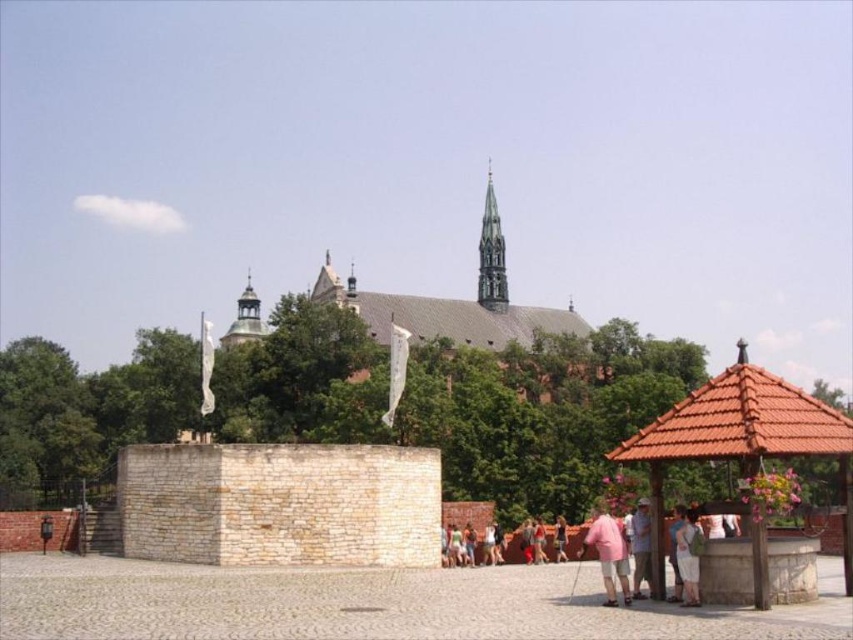
Question: Which object is farther from the camera taking this photo?

Choices:
 (A) pink fabric dress at lower center
 (B) pink cotton shirt at lower center

Answer: (A)

Question: Does pink cotton shirt at lower center have a smaller size compared to red dress at lower right?

Choices:
 (A) yes
 (B) no

Answer: (B)

Question: Does light brown fabric dress at lower right appear under gold textured dome at center?

Choices:
 (A) yes
 (B) no

Answer: (A)

Question: Which point is closer to the camera taking this photo?

Choices:
 (A) (248, 317)
 (B) (631, 518)
 (C) (691, 577)

Answer: (C)

Question: Can you confirm if pink cotton shirt at lower center is positioned above gold textured dome at center?

Choices:
 (A) yes
 (B) no

Answer: (B)

Question: Which of the following is the farthest from the observer?

Choices:
 (A) (643, 522)
 (B) (605, 540)
 (C) (688, 552)
 (D) (737, 356)

Answer: (A)